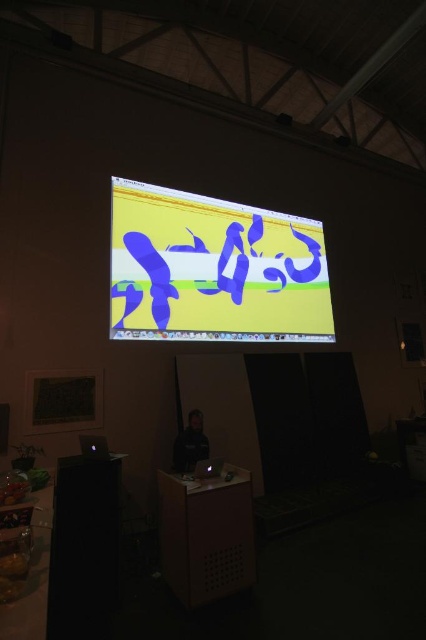
You are setting up a presentation and need to ensure that the matte plastic screen at upper center and the matte black laptop at center are visible to the audience. Based on their heights, which object should be placed lower to ensure both are visible?

The matte black laptop at center should be placed lower since the matte plastic screen at upper center is taller, allowing both to be visible at appropriate heights.

Based on the photo, you are an attendee at the presentation. You notice the matte plastic screen at upper center and the dark fabric jacket at center. Which object is positioned to the right of the other?

The matte plastic screen at upper center is to the right of the dark fabric jacket at center.

You are attending a lecture and want to borrow the laptop from the presenter. Can you reach the black glossy laptop at lower left without moving the dark fabric jacket at center?

The dark fabric jacket at center is further to the viewer than the black glossy laptop at lower left, meaning the jacket is closer to you. Since the jacket is in front of the laptop, you cannot reach the black glossy laptop at lower left without moving the dark fabric jacket at center.